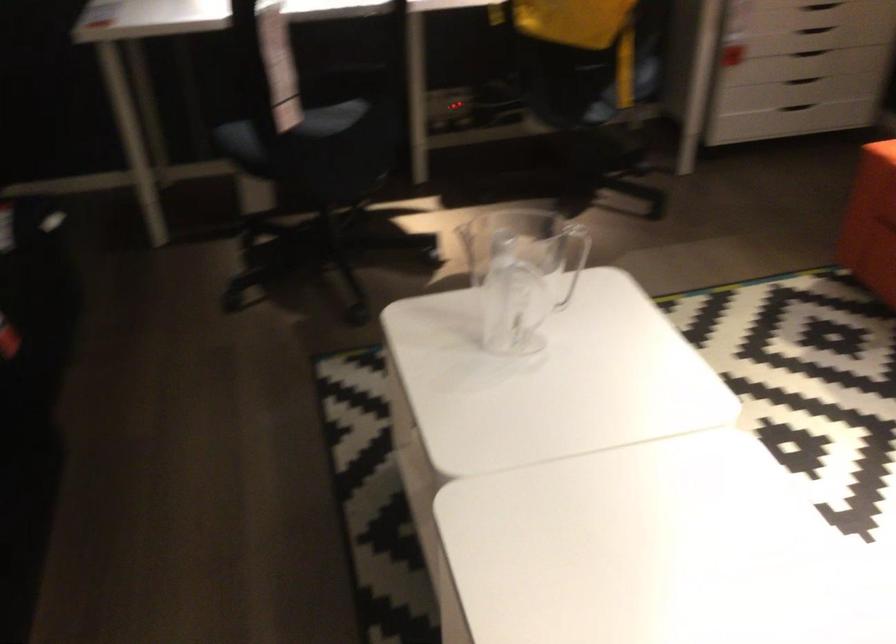
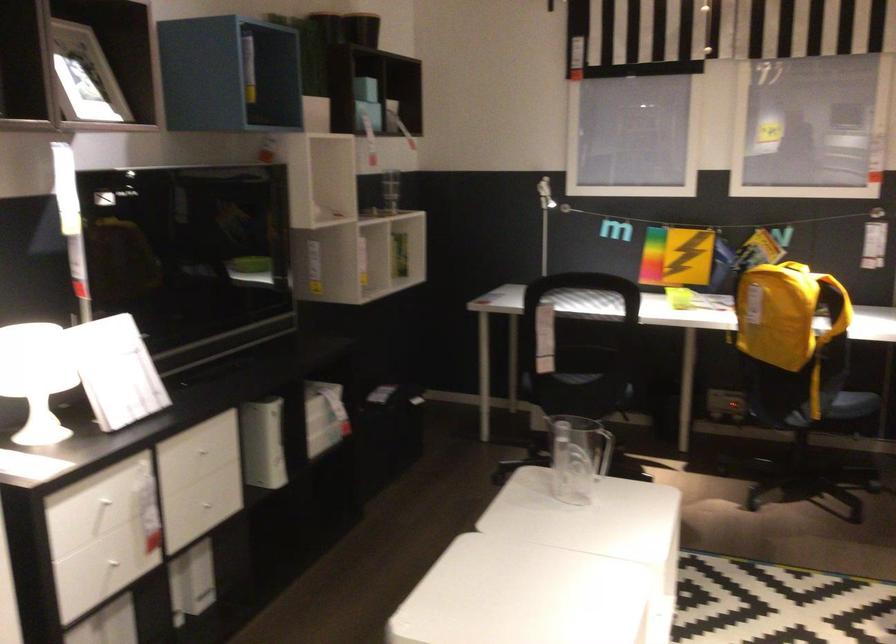
In the second image, find the point that corresponds to the point at 656,96 in the first image.

(854, 404)